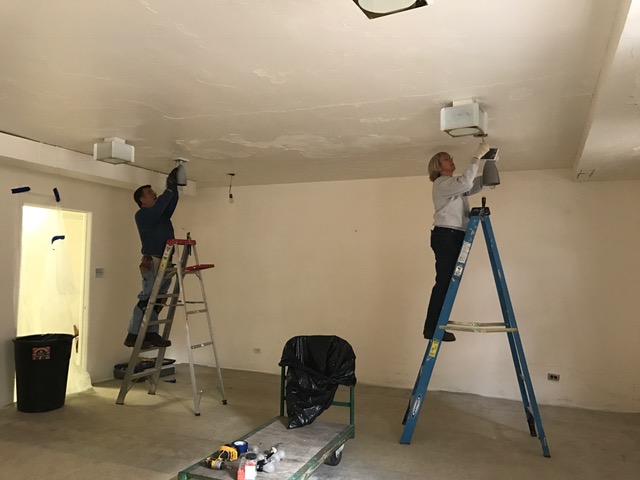
I want to click on electrical outlets, so click(553, 377), click(255, 351).